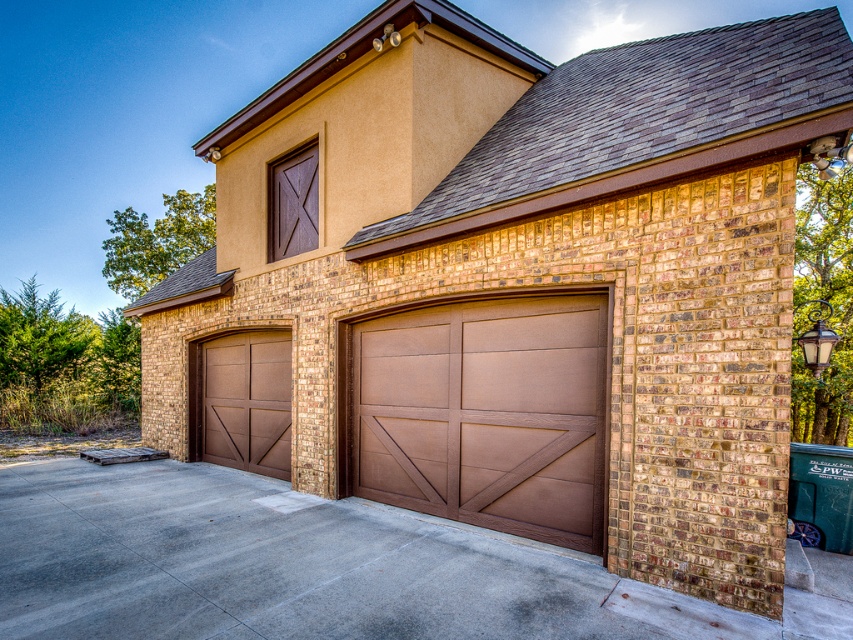
Looking at this image, you are a delivery person with a package that requires a 10 feet clearance between the two doors to pass through. Can you fit your delivery vehicle between the brown woodgrain garage door at center and the brown wood door at left?

The distance between the brown woodgrain garage door at center and the brown wood door at left is 10.88 feet, which is more than the required 10 feet clearance. Therefore, the delivery vehicle can fit between them.